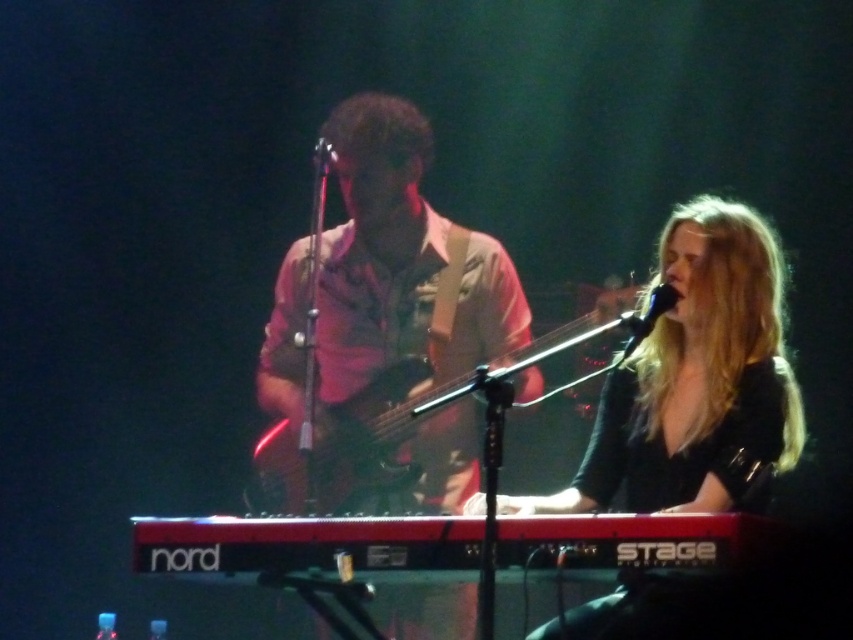
You are a stagehand setting up equipment for a performance. You need to place a tall stand that requires 2 meters of vertical space. You see the wooden electric bass at center and the metallic silver microphone at center. Which object would prevent the stand from fitting due to its height?

The wooden electric bass at center is taller than the metallic silver microphone at center, so the wooden electric bass at center would prevent the stand from fitting due to its height.

You are a stagehand who needs to place a protective cover over the wooden electric bass at center and the metallic silver microphone at center. Given that the cover must be large enough to fully enclose both items, which object determines the minimum required size of the cover?

The wooden electric bass at center has a larger size compared to the metallic silver microphone at center, so the cover must be at least as large as the wooden electric bass at center to fully enclose both items.